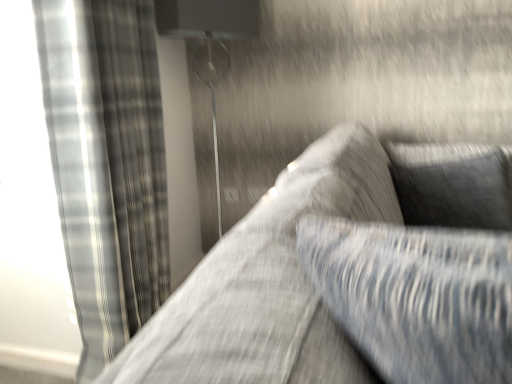
Question: From a real-world perspective, is textured gray couch at center positioned above or below black textured pillow at upper right?

Choices:
 (A) below
 (B) above

Answer: (B)

Question: Does point (240, 304) appear closer or farther from the camera than point (394, 168)?

Choices:
 (A) closer
 (B) farther

Answer: (A)

Question: Estimate the real-world distances between objects in this image. Which object is closer to the metallic silver lamp at upper center?

Choices:
 (A) black textured pillow at upper right
 (B) textured gray couch at center
 (C) plaid fabric curtain at left

Answer: (C)

Question: Estimate the real-world distances between objects in this image. Which object is farther from the plaid fabric curtain at left?

Choices:
 (A) black textured pillow at upper right
 (B) textured gray couch at center
 (C) metallic silver lamp at upper center

Answer: (A)